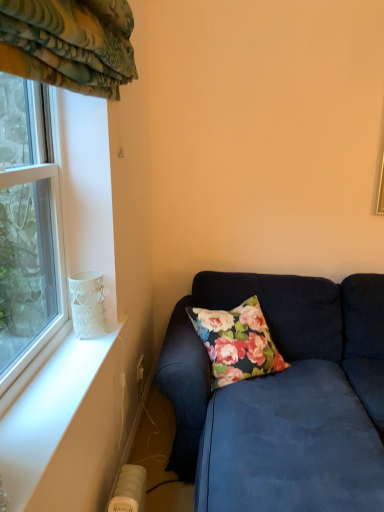
Question: Should I look upward or downward to see velvet blue couch at lower right?

Choices:
 (A) down
 (B) up

Answer: (A)

Question: Is velvet blue couch at lower right closer to camera compared to clear glass window at left?

Choices:
 (A) yes
 (B) no

Answer: (A)

Question: Is velvet blue couch at lower right oriented towards clear glass window at left?

Choices:
 (A) yes
 (B) no

Answer: (B)

Question: Can you confirm if velvet blue couch at lower right is smaller than clear glass window at left?

Choices:
 (A) no
 (B) yes

Answer: (A)

Question: Considering the relative sizes of velvet blue couch at lower right and clear glass window at left in the image provided, is velvet blue couch at lower right thinner than clear glass window at left?

Choices:
 (A) no
 (B) yes

Answer: (A)

Question: Can clear glass window at left be found inside velvet blue couch at lower right?

Choices:
 (A) no
 (B) yes

Answer: (A)

Question: Does velvet blue couch at lower right appear on the left side of clear glass window at left?

Choices:
 (A) yes
 (B) no

Answer: (B)

Question: Is velvet blue couch at lower right in front of white lace glass at window?

Choices:
 (A) yes
 (B) no

Answer: (A)

Question: Does velvet blue couch at lower right appear on the right side of white lace glass at window?

Choices:
 (A) no
 (B) yes

Answer: (B)

Question: Does velvet blue couch at lower right lie behind white lace glass at window?

Choices:
 (A) no
 (B) yes

Answer: (A)

Question: Considering the relative sizes of velvet blue couch at lower right and white lace glass at window in the image provided, is velvet blue couch at lower right taller than white lace glass at window?

Choices:
 (A) yes
 (B) no

Answer: (A)

Question: Can you confirm if velvet blue couch at lower right is thinner than white lace glass at window?

Choices:
 (A) no
 (B) yes

Answer: (A)

Question: Does velvet blue couch at lower right have a smaller size compared to white lace glass at window?

Choices:
 (A) yes
 (B) no

Answer: (B)

Question: Is clear glass window at left aimed at white lace glass at window?

Choices:
 (A) no
 (B) yes

Answer: (B)